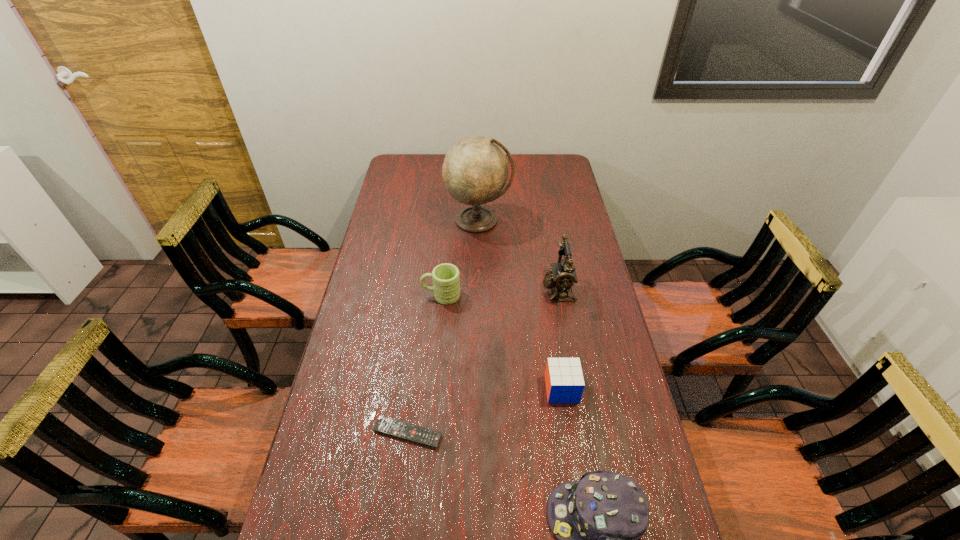
You are a GUI agent. You are given a task and a screenshot of the screen. Output one action in this format:
    pyautogui.click(x=<x>, y=<y>)
    Task: Click on the vacant region at the far edge of the desktop
    
    Given the screenshot: What is the action you would take?
    pyautogui.click(x=433, y=173)

At what (x,y) coordinates should I click in order to perform the action: click on free space at the left edge. Please return your answer as a coordinate pair (x, y). The height and width of the screenshot is (540, 960). Looking at the image, I should click on (380, 232).

The width and height of the screenshot is (960, 540). Identify the location of free space at the right edge of the desktop. (605, 338).

Where is `blank area at the far right corner`? blank area at the far right corner is located at coordinates (551, 159).

The width and height of the screenshot is (960, 540). In order to click on vacant area between the second nearest object and the fifth tallest object in this screenshot , I will do `click(485, 411)`.

Where is `free spot between the remote control and the cube`? This screenshot has width=960, height=540. free spot between the remote control and the cube is located at coordinates click(485, 411).

This screenshot has height=540, width=960. Find the location of `free spot between the tallest object and the telephone`. free spot between the tallest object and the telephone is located at coordinates (518, 255).

The height and width of the screenshot is (540, 960). I want to click on vacant area between the remote control and the tallest object, so click(444, 327).

Locate an element on the screen. free space that is in between the fifth farthest object and the fourth farthest object is located at coordinates (485, 411).

In order to click on free space between the mug and the second tallest object in this screenshot , I will do click(x=500, y=292).